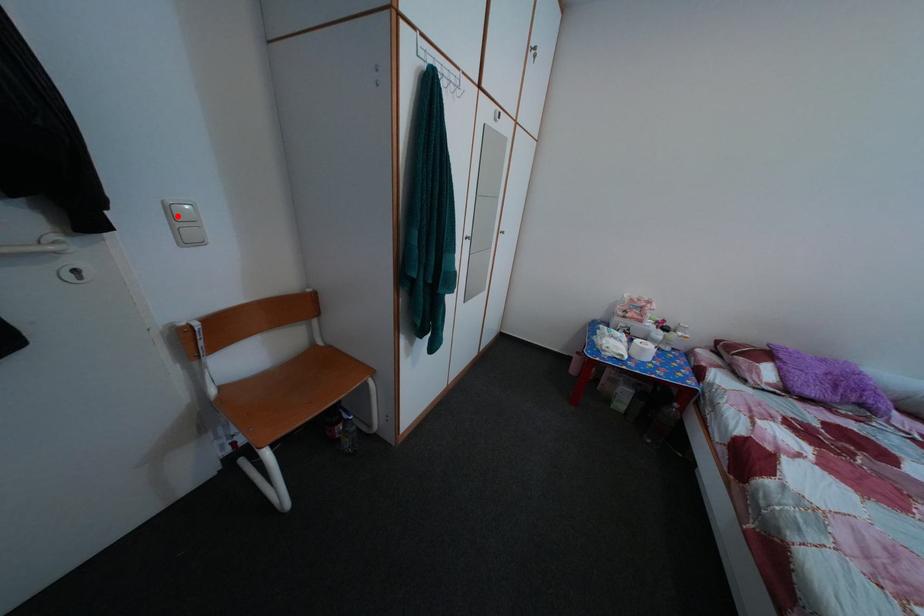
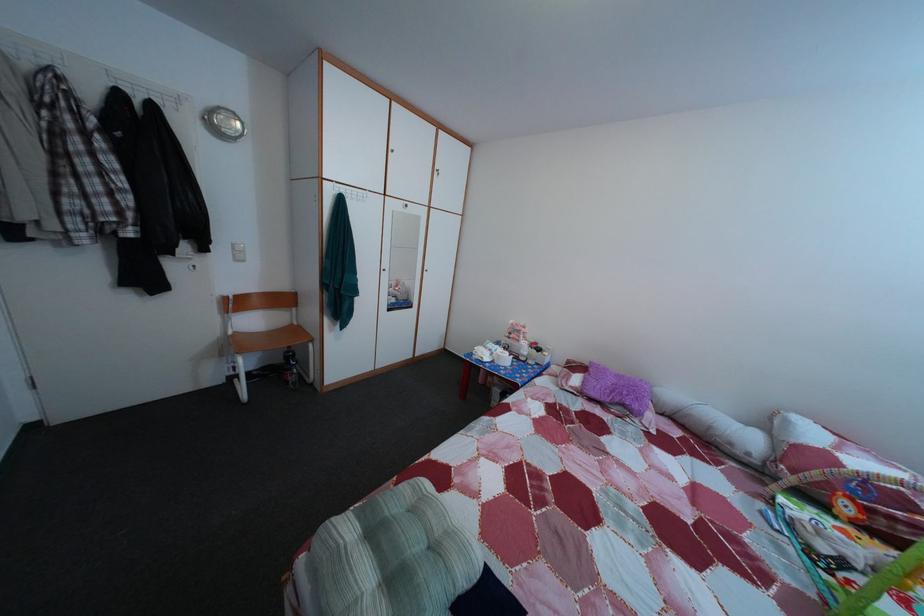
Question: A red point is marked in image1. In image2, is the corresponding 3D point closer to the camera or farther? Reply with the corresponding letter.

Choices:
 (A) The corresponding 3D point is closer.
 (B) The corresponding 3D point is farther.

Answer: (A)